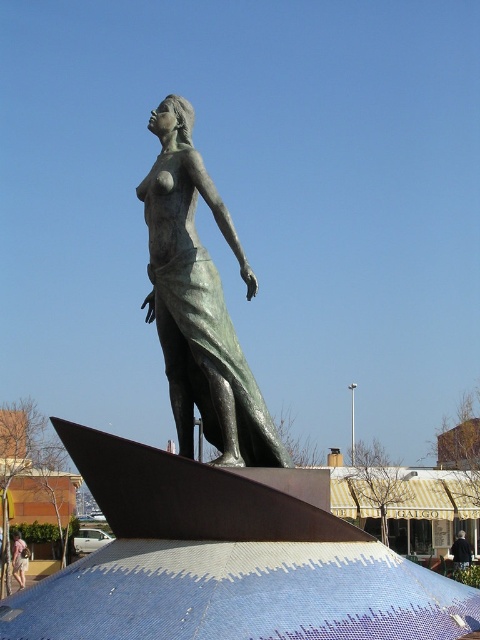
Question: Does green patina bronze statue at center have a greater width compared to black fabric coat at lower right?

Choices:
 (A) no
 (B) yes

Answer: (B)

Question: Which of the following is the closest to the observer?

Choices:
 (A) pos(169,140)
 (B) pos(464,552)
 (C) pos(16,573)

Answer: (A)

Question: Among these objects, which one is farthest from the camera?

Choices:
 (A) light pink fabric dress at lower left
 (B) green patina bronze statue at center
 (C) black fabric coat at lower right

Answer: (C)

Question: Which object is closer to the camera taking this photo?

Choices:
 (A) light pink fabric dress at lower left
 (B) green patina bronze statue at center
 (C) black fabric coat at lower right

Answer: (B)

Question: Does light pink fabric dress at lower left appear on the right side of black fabric coat at lower right?

Choices:
 (A) yes
 (B) no

Answer: (B)

Question: Can you confirm if light pink fabric dress at lower left is thinner than black fabric coat at lower right?

Choices:
 (A) no
 (B) yes

Answer: (B)